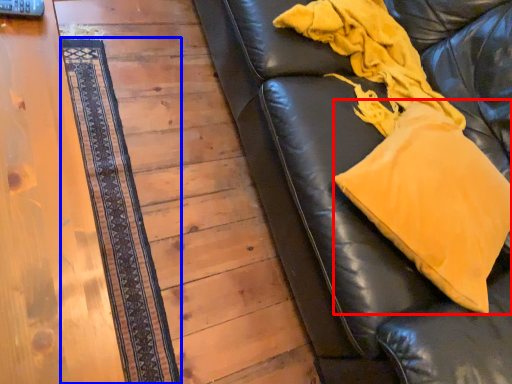
Question: Which point is further to the camera, throw pillow (highlighted by a red box) or mat (highlighted by a blue box)?

Choices:
 (A) throw pillow
 (B) mat

Answer: (B)